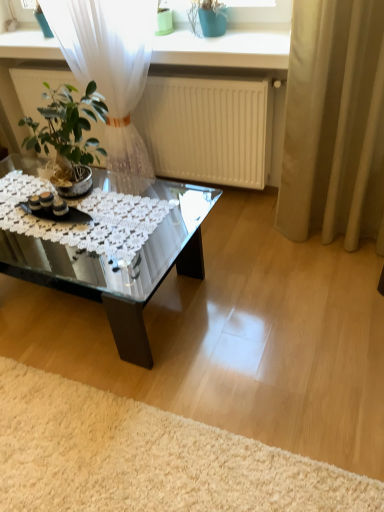
Identify the location of free location to the right of transparent glass coffee table at center. (284, 322).